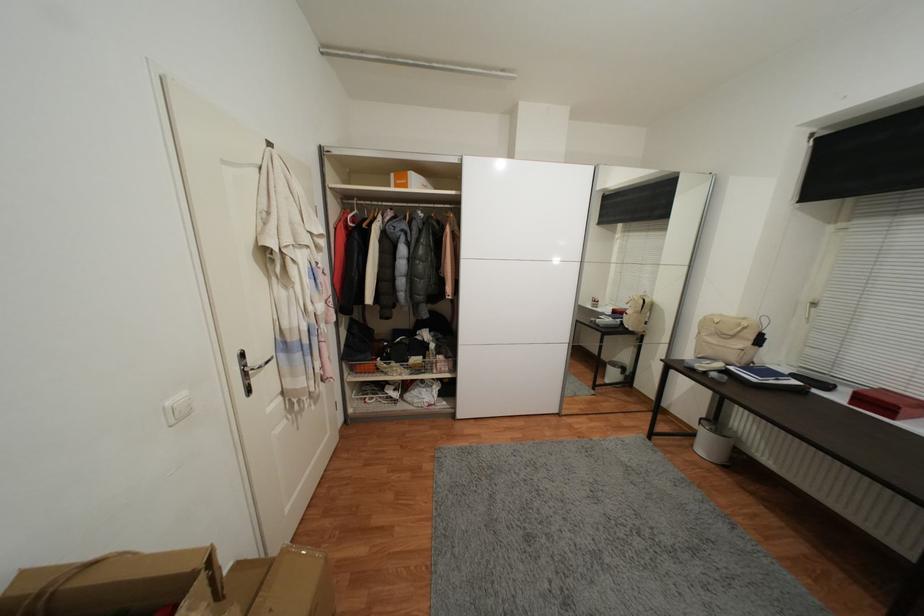
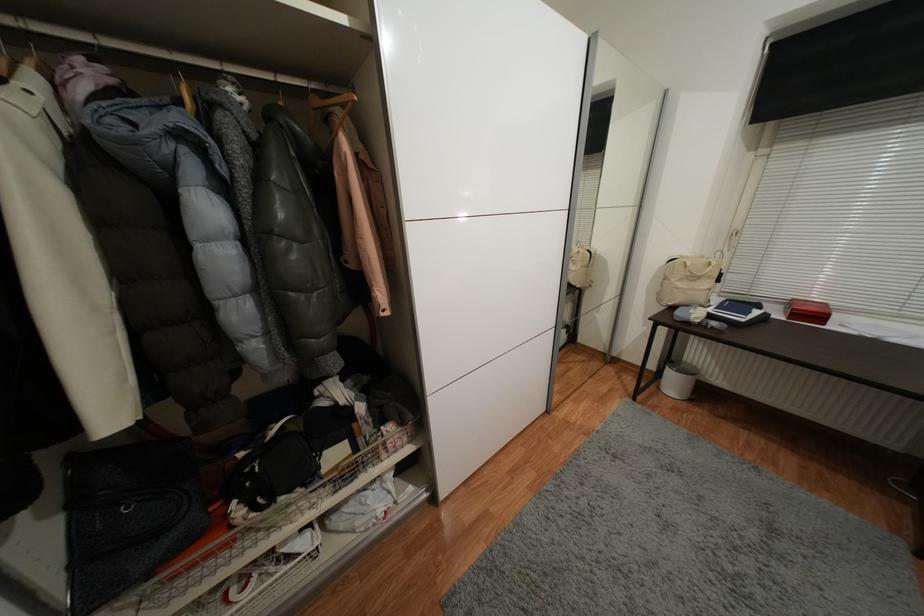
The point at (x=697, y=447) is marked in the first image. Where is the corresponding point in the second image?

(663, 390)